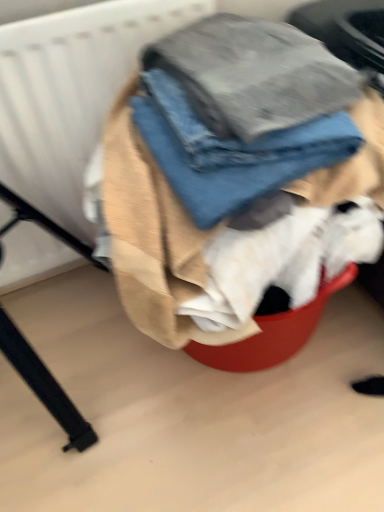
At what (x,y) coordinates should I click in order to perform the action: click on free point above denim jeans at center (from a real-world perspective). Please return your answer as a coordinate pair (x, y). The width and height of the screenshot is (384, 512). Looking at the image, I should click on 230,72.